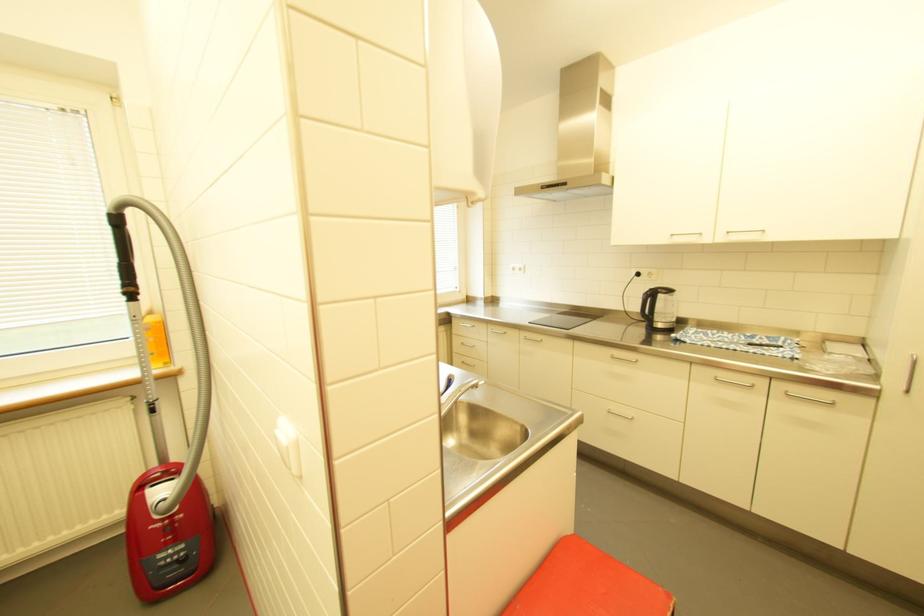
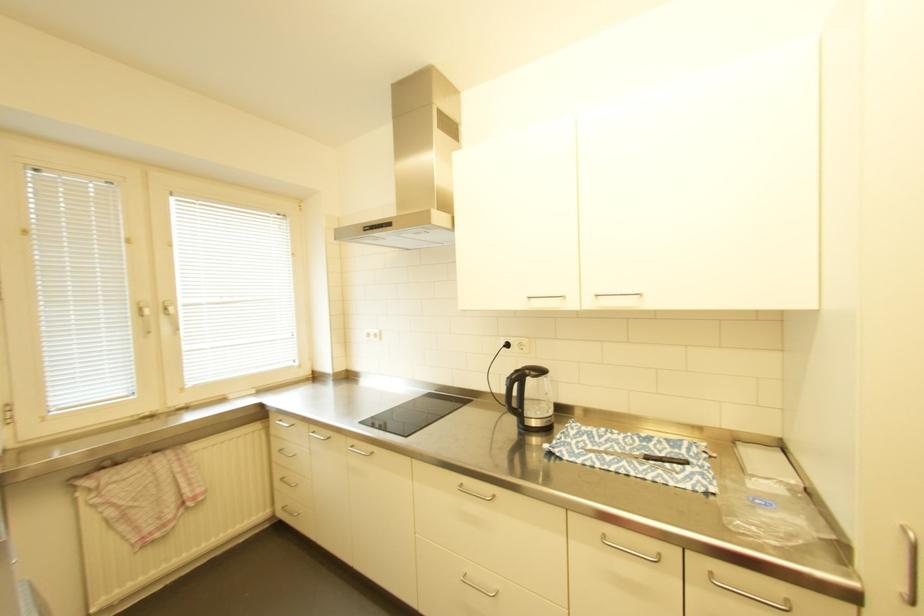
Locate, in the second image, the point that corresponds to the point at 651,294 in the first image.

(516, 379)